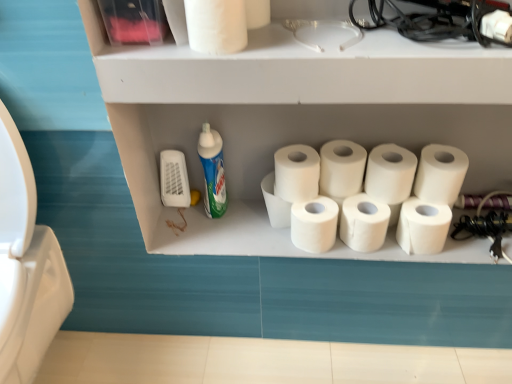
Locate an element on the screen. free point to the left of white matte toilet paper at center, which is counted as the seventh toilet paper, starting from the right is located at coordinates (246, 233).